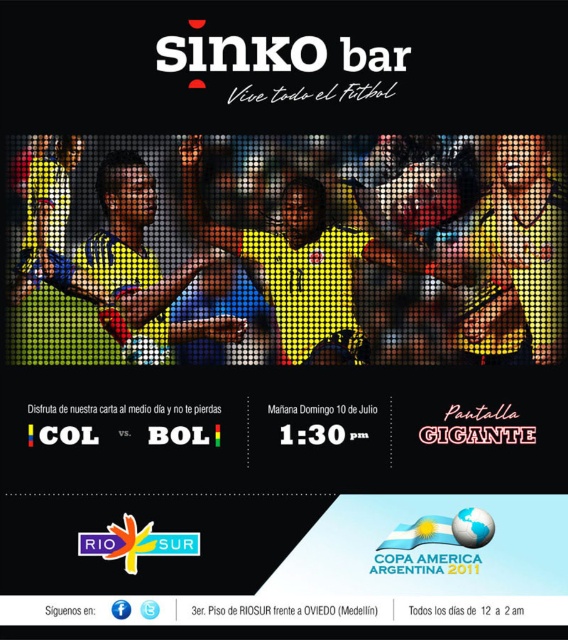
Who is more distant from viewer, (x=421, y=362) or (x=252, y=612)?

Point (x=421, y=362)

In the scene shown: Is yellow matte jersey at center below white paper at center?

No.

You are a GUI agent. You are given a task and a screenshot of the screen. Output one action in this format:
    pyautogui.click(x=<x>, y=<y>)
    Task: Click on the yellow matte jersey at center
    This screenshot has height=640, width=568.
    Given the screenshot: What is the action you would take?
    pyautogui.click(x=356, y=262)

Image resolution: width=568 pixels, height=640 pixels. I want to click on yellow matte jersey at center, so click(x=356, y=262).

Does yellow jersey at center have a greater height compared to white paper at center?

Yes.

Who is higher up, yellow jersey at center or white paper at center?

yellow jersey at center is higher up.

Is point (64, 300) positioned behind point (229, 604)?

Yes, it is.

Where is `yellow jersey at center`? This screenshot has width=568, height=640. yellow jersey at center is located at coordinates (99, 275).

Who is positioned more to the left, yellow matte jersey at center or yellow jersey at center?

From the viewer's perspective, yellow jersey at center appears more on the left side.

Does yellow matte jersey at center appear on the right side of yellow jersey at center?

Yes, yellow matte jersey at center is to the right of yellow jersey at center.

Is point (442, 360) closer to viewer compared to point (39, 273)?

No, it is not.

The image size is (568, 640). Identify the location of yellow matte jersey at center. (356, 262).